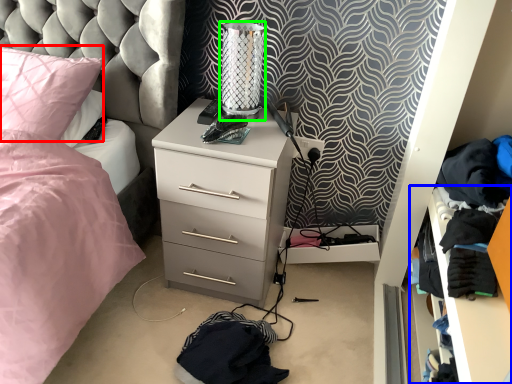
Question: Estimate the real-world distances between objects in this image. Which object is closer to pillow (highlighted by a red box), shelf (highlighted by a blue box) or table lamp (highlighted by a green box)?

Choices:
 (A) shelf
 (B) table lamp

Answer: (B)